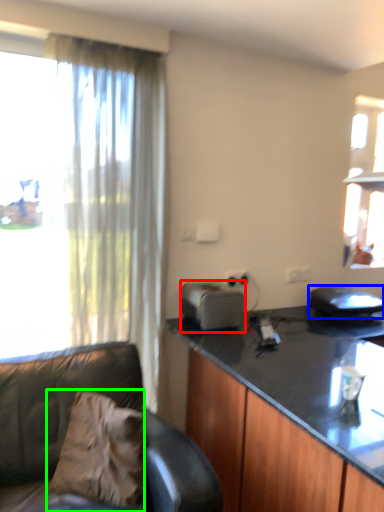
Question: Estimate the real-world distances between objects in this image. Which object is closer to appliance (highlighted by a red box), appliance (highlighted by a blue box) or pillow (highlighted by a green box)?

Choices:
 (A) appliance
 (B) pillow

Answer: (B)